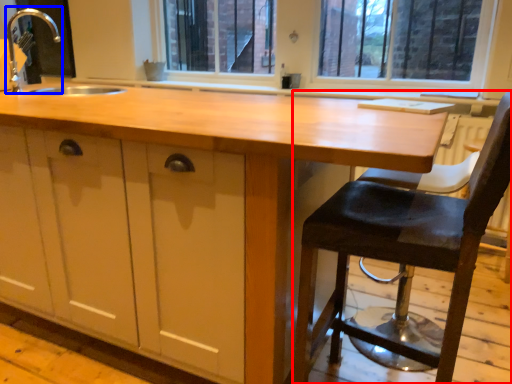
Question: Which object appears farthest to the camera in this image, chair (highlighted by a red box) or faucet (highlighted by a blue box)?

Choices:
 (A) chair
 (B) faucet

Answer: (B)